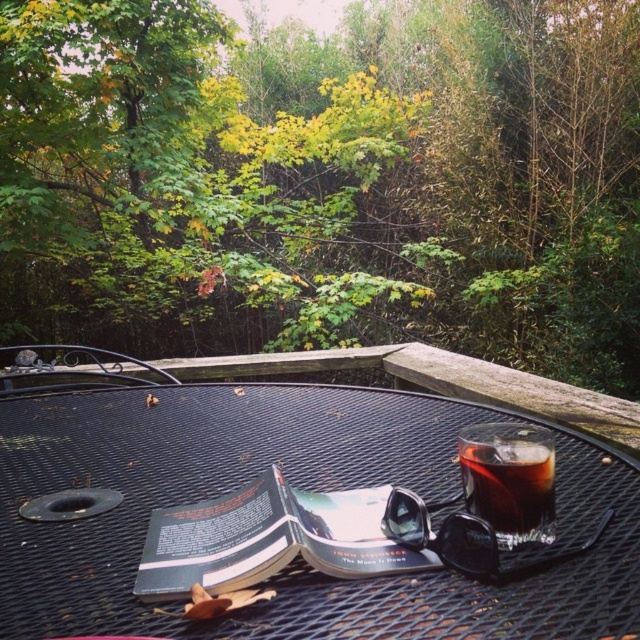
Between black mesh table at center and dark glass cup at center, which one has less height?

With less height is black mesh table at center.

Between point (106, 618) and point (547, 449), which one is positioned in front?

Positioned in front is point (106, 618).

What are the coordinates of `black mesh table at center` in the screenshot? It's located at (298, 488).

Measure the distance between green leafy tree at upper center and black mesh table at center.

The distance of green leafy tree at upper center from black mesh table at center is 13.59 feet.

Does green leafy tree at upper center appear under black mesh table at center?

No.

Between point (164, 173) and point (400, 621), which one is positioned behind?

The point (164, 173) is behind.

Identify the location of green leafy tree at upper center. pyautogui.click(x=326, y=179).

Is point (500, 266) less distant than point (461, 436)?

No.

Does green leafy tree at upper center have a greater width compared to dark glass cup at center?

Indeed, green leafy tree at upper center has a greater width compared to dark glass cup at center.

Is point (115, 278) closer to camera compared to point (552, 502)?

No, (115, 278) is further to viewer.

This screenshot has height=640, width=640. I want to click on green leafy tree at upper center, so click(326, 179).